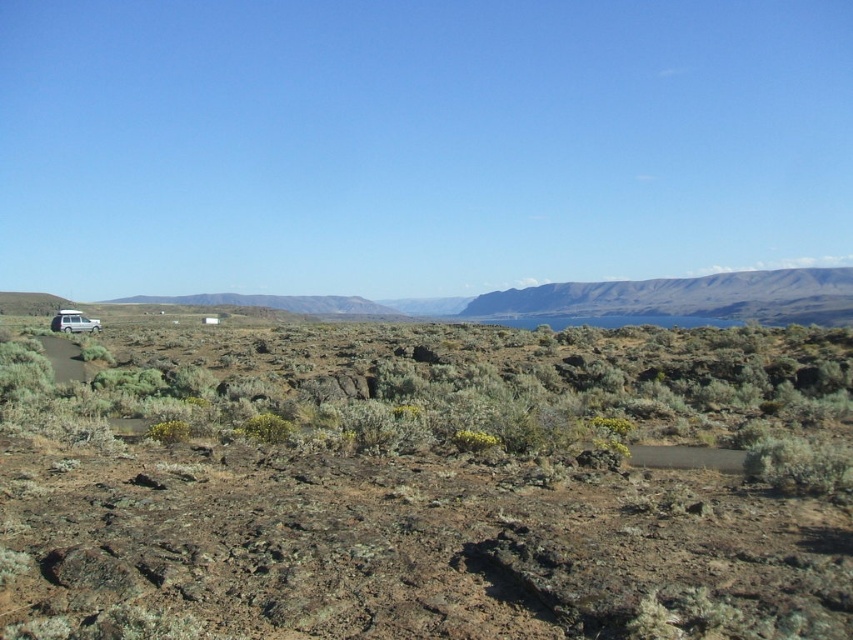
From the picture: Between brown rocky terrain at left and silver metallic suv at left, which one has less height?

With less height is silver metallic suv at left.

Is point (593, 339) more distant than point (71, 326)?

No, it is not.

Where is `brown rocky terrain at left`? brown rocky terrain at left is located at coordinates (425, 483).